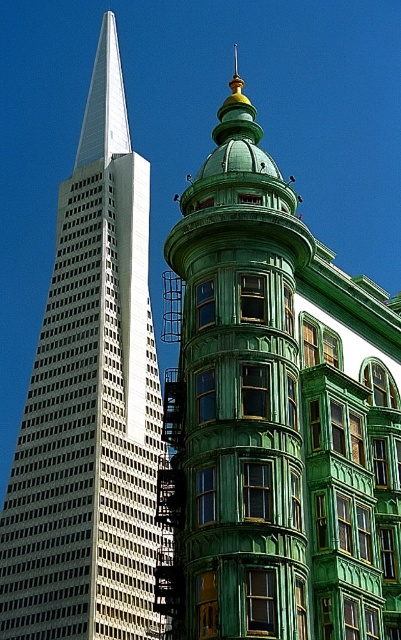
Between green glossy building at center and white glass skyscraper at left, which one is positioned lower?

green glossy building at center is below.

Between green glossy building at center and white glass skyscraper at left, which one has less height?

Standing shorter between the two is green glossy building at center.

Find the location of a particular element. This screenshot has height=640, width=401. green glossy building at center is located at coordinates (275, 416).

You are a GUI agent. You are given a task and a screenshot of the screen. Output one action in this format:
    pyautogui.click(x=<x>, y=<y>)
    Task: Click on the green glossy building at center
    
    Given the screenshot: What is the action you would take?
    pyautogui.click(x=275, y=416)